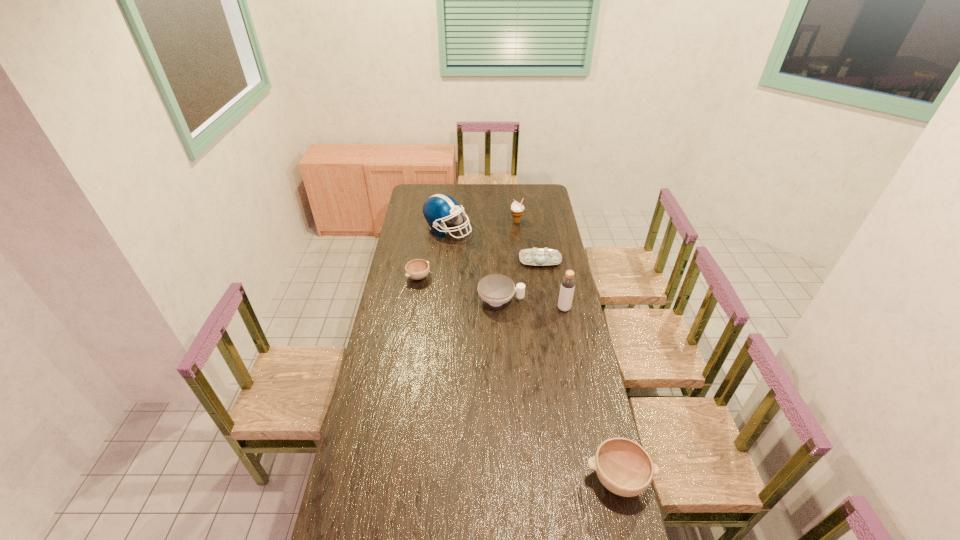
Locate an element on the screen. The width and height of the screenshot is (960, 540). free location located on the left of the nearer bowl is located at coordinates (502, 478).

Where is `free space located 0.340m on the left of the fifth shortest object`? free space located 0.340m on the left of the fifth shortest object is located at coordinates (453, 222).

Find the location of `vacant area situated 0.390m at the front of the football helmet with the faceguard`. vacant area situated 0.390m at the front of the football helmet with the faceguard is located at coordinates (538, 230).

This screenshot has width=960, height=540. In order to click on free space located on the front of the farther chinaware in this screenshot , I will do `click(548, 309)`.

This screenshot has width=960, height=540. Find the location of `free spot located 0.160m on the side with the handle of the nearer chinaware`. free spot located 0.160m on the side with the handle of the nearer chinaware is located at coordinates (557, 301).

Find the location of `free location located 0.310m on the left of the bottle`. free location located 0.310m on the left of the bottle is located at coordinates click(x=492, y=308).

What are the coordinates of `bowl present at the left edge` in the screenshot? It's located at (417, 269).

Where is `football helmet present at the left edge`? The width and height of the screenshot is (960, 540). football helmet present at the left edge is located at coordinates (438, 208).

The width and height of the screenshot is (960, 540). I want to click on bowl situated at the right edge, so click(623, 466).

Find the location of a particular element. The height and width of the screenshot is (540, 960). chinaware present at the right edge is located at coordinates (536, 256).